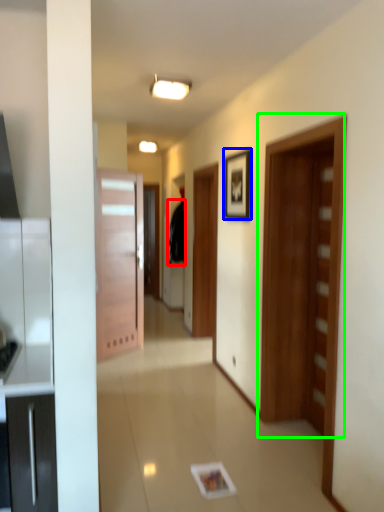
Question: Which is farther away from robe (highlighted by a red box)? picture frame (highlighted by a blue box) or door (highlighted by a green box)?

Choices:
 (A) picture frame
 (B) door

Answer: (B)